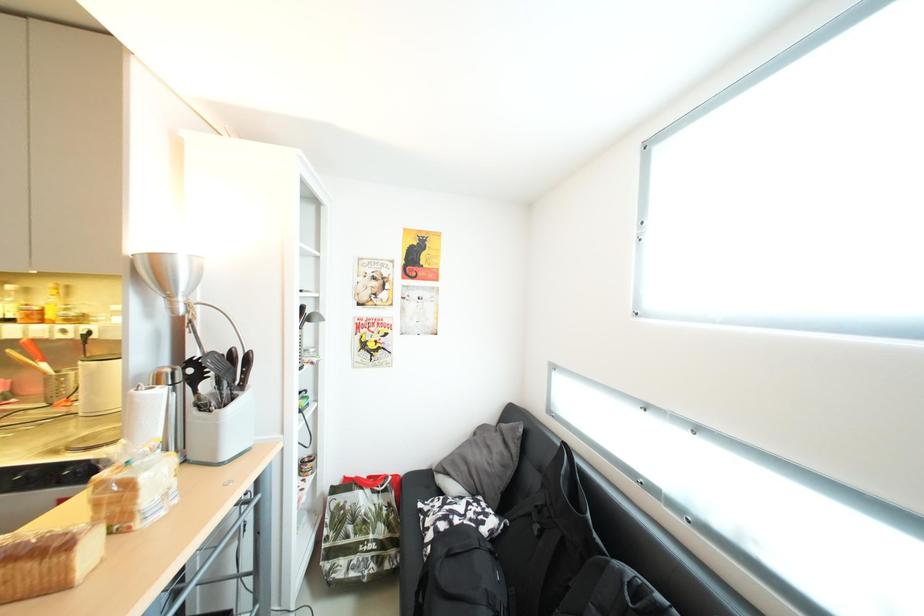
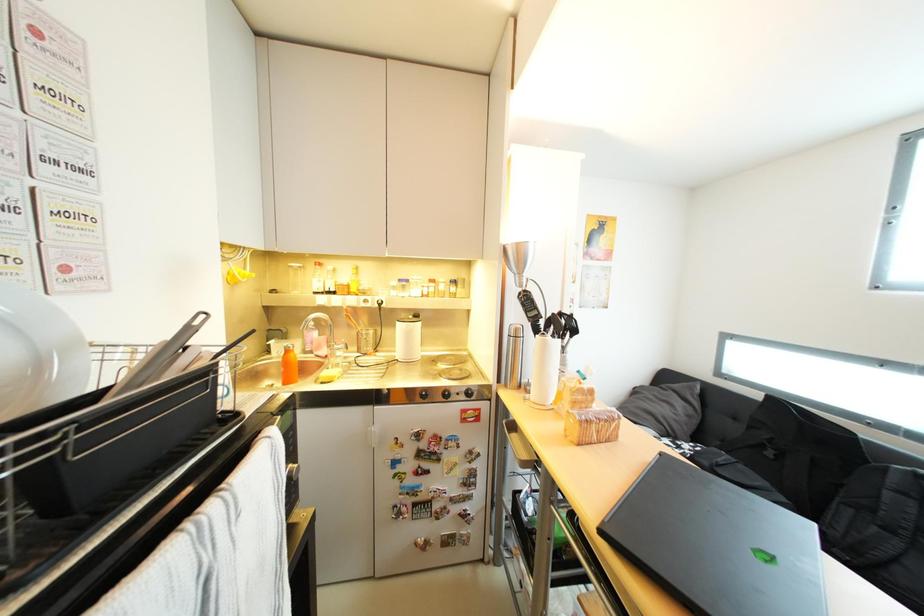
Question: In a continuous first-person perspective shot, in which direction is the camera moving?

Choices:
 (A) Left
 (B) Right
 (C) Forward
 (D) Backward

Answer: (A)